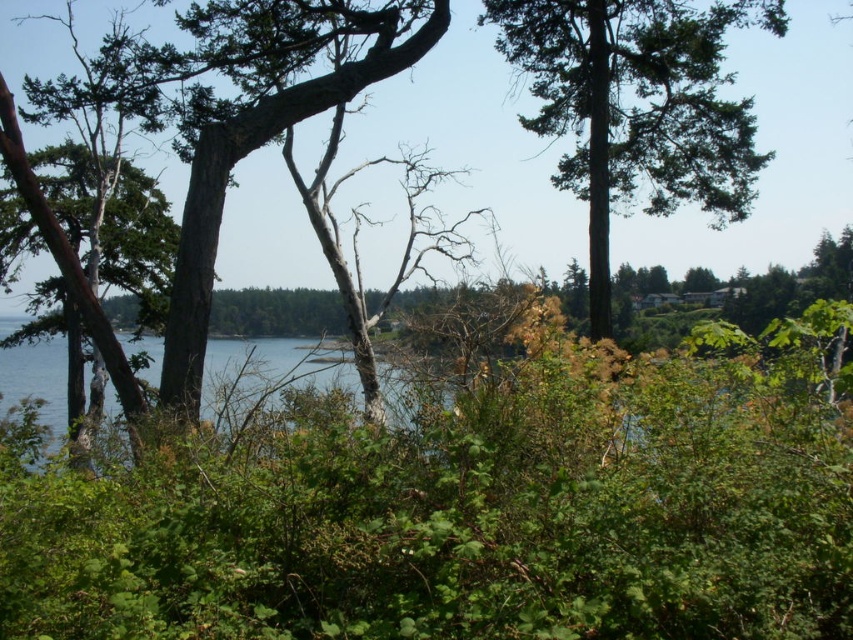
The width and height of the screenshot is (853, 640). What do you see at coordinates (637, 106) in the screenshot?
I see `green textured tree at center` at bounding box center [637, 106].

Which of these two, green textured tree at center or blue water at center, stands shorter?

Standing shorter between the two is blue water at center.

I want to click on green textured tree at center, so click(x=637, y=106).

Is point (780, 20) positioned behind point (405, 52)?

Yes, point (780, 20) is behind point (405, 52).

Does point (534, 35) come in front of point (10, 113)?

No, it is behind (10, 113).

Is point (726, 6) positioned behind point (198, 333)?

Yes, it is behind point (198, 333).

Identify the location of green textured tree at center. (637, 106).

Who is more forward, (186, 202) or (241, 344)?

Point (186, 202)

Who is shorter, green rough bark tree at center or blue water at center?

With less height is green rough bark tree at center.

Which is behind, point (57, 225) or point (216, 385)?

Positioned behind is point (57, 225).

Locate an element on the screen. The height and width of the screenshot is (640, 853). green rough bark tree at center is located at coordinates (227, 180).